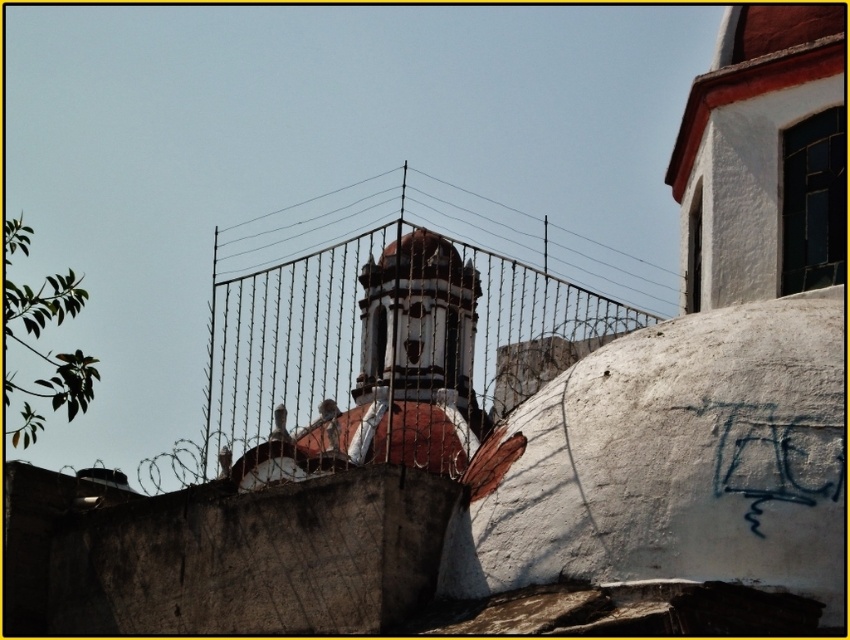
You are standing in front of the building and notice two points marked on the dome structure. The first point is at coordinates point (296, 454) and the second at point (720, 449). Which point is closer to your current position?

Point (296, 454) is further to the camera than point (720, 449), so the point closer to your position is point (720, 449).